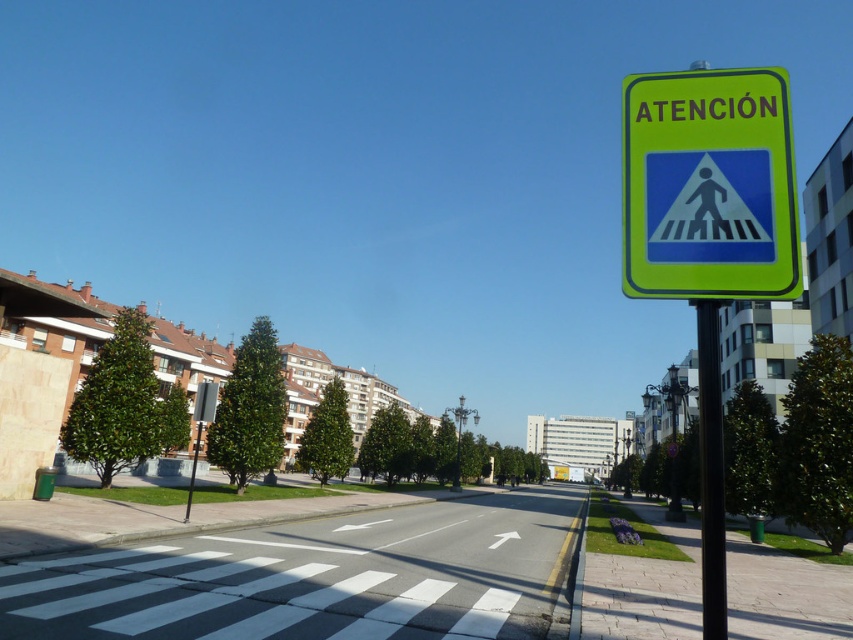
Question: Which object is closer to the camera taking this photo?

Choices:
 (A) metallic pole at right
 (B) yellow-green plastic pedestrian crossing sign at upper right
 (C) metallic parking sign at left

Answer: (B)

Question: Does yellow-green plastic pedestrian crossing sign at upper right have a greater width compared to metallic pole at right?

Choices:
 (A) no
 (B) yes

Answer: (B)

Question: Is the position of yellow-green plastic pedestrian crossing sign at upper right less distant than that of metallic pole at right?

Choices:
 (A) no
 (B) yes

Answer: (B)

Question: Does yellow-green plastic pedestrian crossing sign at upper right have a lesser width compared to metallic pole at right?

Choices:
 (A) yes
 (B) no

Answer: (B)

Question: Which point appears closest to the camera in this image?

Choices:
 (A) (195, 451)
 (B) (701, 179)
 (C) (701, 406)

Answer: (C)

Question: Which of the following is the farthest from the observer?

Choices:
 (A) metallic parking sign at left
 (B) yellow-green plastic pedestrian crossing sign at upper right
 (C) metallic pole at right

Answer: (A)